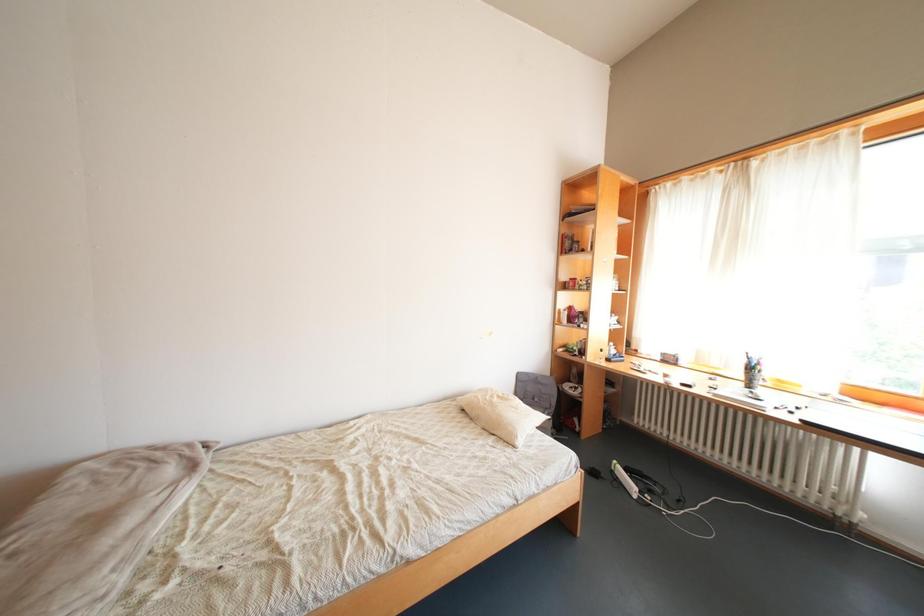
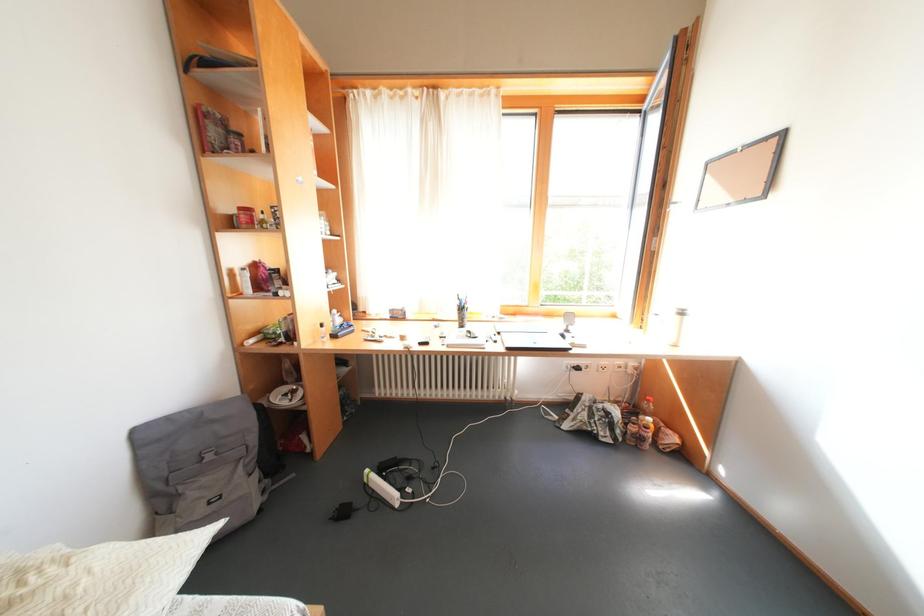
Question: How did the camera likely rotate?

Choices:
 (A) Left
 (B) Right
 (C) Up
 (D) Down

Answer: (B)